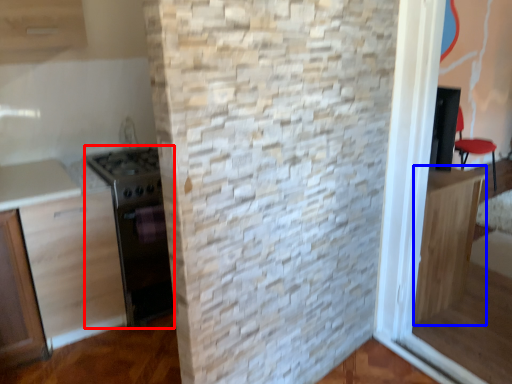
Question: Which of the following is the closest to the observer, appliance (highlighted by a red box) or cabinetry (highlighted by a blue box)?

Choices:
 (A) appliance
 (B) cabinetry

Answer: (B)